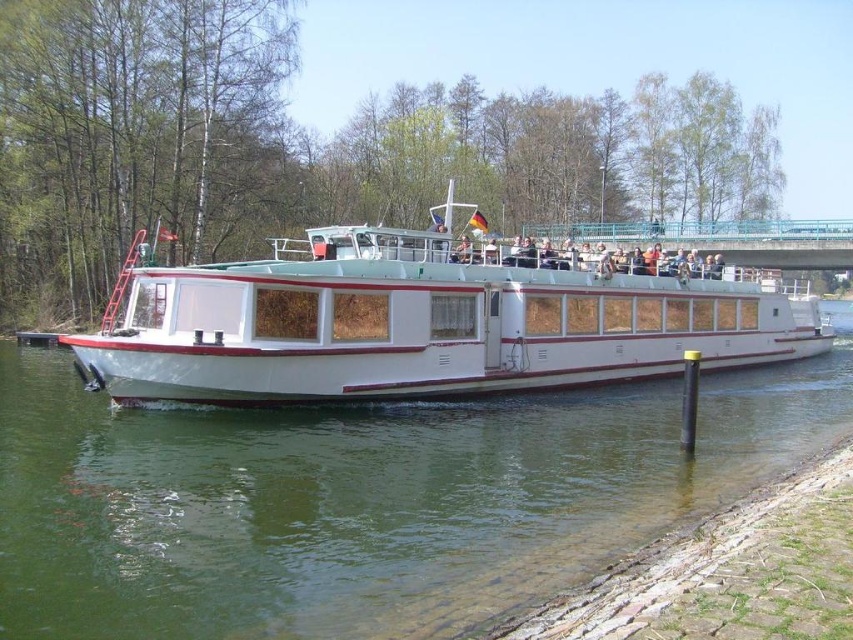
Question: Which point is closer to the camera?

Choices:
 (A) click(x=315, y=310)
 (B) click(x=802, y=266)
 (C) click(x=260, y=474)

Answer: (C)

Question: Among these points, which one is nearest to the camera?

Choices:
 (A) (556, 228)
 (B) (109, 321)
 (C) (85, 451)

Answer: (C)

Question: Is the position of white glossy boat at center less distant than that of blue metallic bridge at upper center?

Choices:
 (A) yes
 (B) no

Answer: (A)

Question: Which point is closer to the camera taking this photo?

Choices:
 (A) (772, 257)
 (B) (271, 566)
 (C) (309, 307)

Answer: (B)

Question: Can you confirm if white glossy boat at center is positioned above blue metallic bridge at upper center?

Choices:
 (A) yes
 (B) no

Answer: (B)

Question: Considering the relative positions of green water at lower left and white glossy boat at center in the image provided, where is green water at lower left located with respect to white glossy boat at center?

Choices:
 (A) right
 (B) left

Answer: (B)